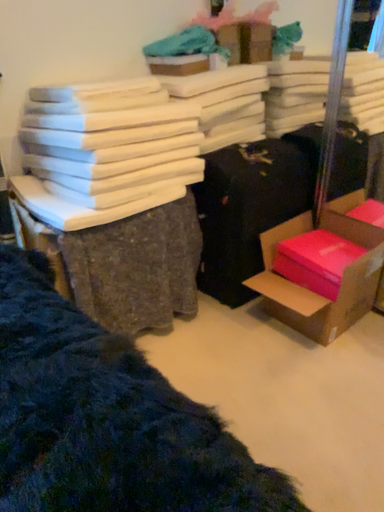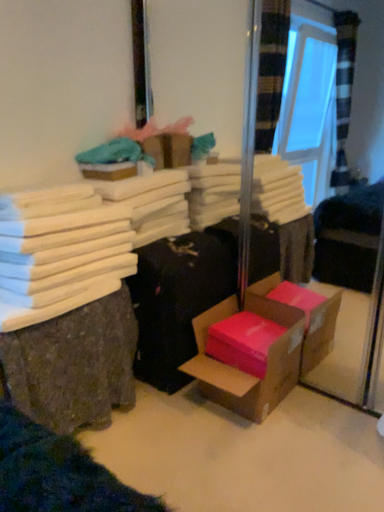
Question: Which way did the camera rotate in the video?

Choices:
 (A) rotated right
 (B) rotated left

Answer: (A)